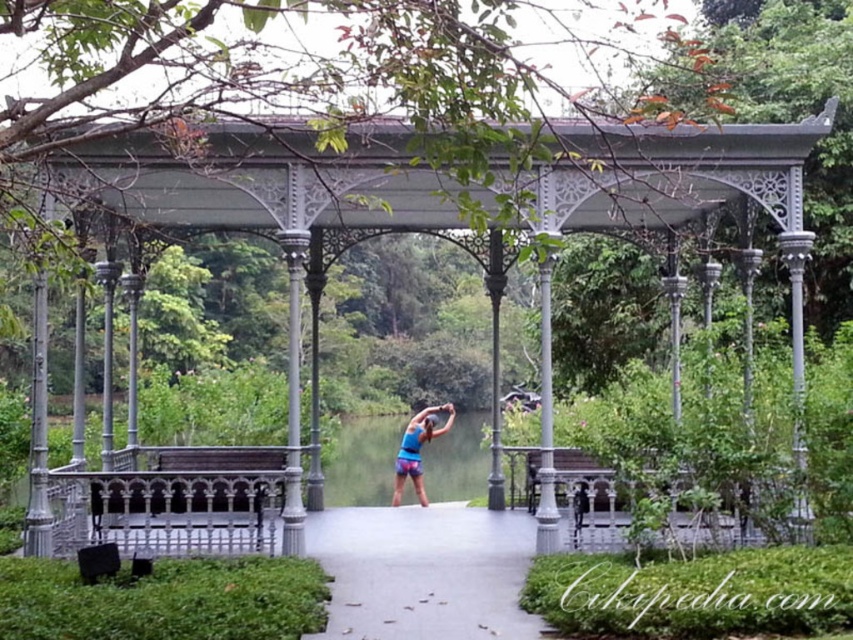
You are planning to set up a small picnic area in the park. You want to place a picnic blanket between the metallic gazebo at center and the wooden bench at center. Which object should you position the blanket closer to if you want it to be wider than the narrower object but narrower than the wider object?

You should position the picnic blanket closer to the metallic gazebo at center because it is the narrower object. The blanket should be wider than the metallic gazebo at center but narrower than the wooden bench at center, which is wider.

You are a park visitor carrying a 2.5 meter long kite. You want to place the kite between the metallic gazebo at center and the wooden bench at center without touching either. Is this possible?

The metallic gazebo at center and wooden bench at center are 2.51 meters apart. Since the kite is 2.5 meters long, there is enough space between them to place the kite without touching either object.